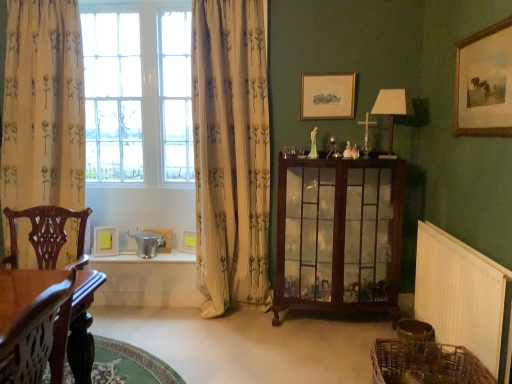
What is the approximate width of matte silver picture frame at upper center, marked as the 2th picture frame in a right-to-left arrangement?

matte silver picture frame at upper center, marked as the 2th picture frame in a right-to-left arrangement, is 1.71 inches in width.

What do you see at coordinates (188, 242) in the screenshot?
I see `matte white picture frame at lower center, which is the third picture frame from left to right` at bounding box center [188, 242].

Image resolution: width=512 pixels, height=384 pixels. What do you see at coordinates (148, 280) in the screenshot?
I see `metallic silver table at lower center` at bounding box center [148, 280].

Identify the location of metallic silver table at lower center. Image resolution: width=512 pixels, height=384 pixels. (148, 280).

Image resolution: width=512 pixels, height=384 pixels. Identify the location of mahogany glass cabinet at center. (339, 235).

What do you see at coordinates (484, 82) in the screenshot? I see `wooden framed painting at upper right, placed as the fifth picture frame when sorted from back to front` at bounding box center [484, 82].

The height and width of the screenshot is (384, 512). What do you see at coordinates (105, 241) in the screenshot? I see `yellow paper at window, the 3th picture frame from the front` at bounding box center [105, 241].

Locate an element on the screen. white glass window at upper left is located at coordinates (138, 93).

Where is `matte silver picture frame at upper center, which ranks as the fourth picture frame in left-to-right order`? The image size is (512, 384). matte silver picture frame at upper center, which ranks as the fourth picture frame in left-to-right order is located at coordinates (327, 96).

Can you confirm if white fabric lampshade at right is wider than white floral fabric curtain at left, positioned as the 2th curtain in left-to-right order?

In fact, white fabric lampshade at right might be narrower than white floral fabric curtain at left, positioned as the 2th curtain in left-to-right order.

Is point (409, 112) more distant than point (255, 101)?

No, it is in front of (255, 101).

From the image's perspective, would you say white fabric lampshade at right is positioned over white floral fabric curtain at left, acting as the 1th curtain starting from the right?

Yes, from the image's perspective, white fabric lampshade at right is over white floral fabric curtain at left, acting as the 1th curtain starting from the right.

Looking at this image, is white fabric lampshade at right taller than white floral fabric curtain at left, acting as the 1th curtain starting from the right?

Incorrect, the height of white fabric lampshade at right is not larger of that of white floral fabric curtain at left, acting as the 1th curtain starting from the right.

Are metallic silver table at lower center and wooden framed painting at upper right, the 5th picture frame in the left-to-right sequence, beside each other?

metallic silver table at lower center and wooden framed painting at upper right, the 5th picture frame in the left-to-right sequence, are not in contact.

Is metallic silver table at lower center inside or outside of wooden framed painting at upper right, which is the first picture frame in front-to-back order?

metallic silver table at lower center is not inside wooden framed painting at upper right, which is the first picture frame in front-to-back order, it's outside.

Looking at this image, is metallic silver table at lower center at the right side of wooden framed painting at upper right, the 5th picture frame in the left-to-right sequence?

No, metallic silver table at lower center is not to the right of wooden framed painting at upper right, the 5th picture frame in the left-to-right sequence.

Considering the sizes of objects metallic silver table at lower center and wooden framed painting at upper right, the 5th picture frame in the left-to-right sequence, in the image provided, who is wider, metallic silver table at lower center or wooden framed painting at upper right, the 5th picture frame in the left-to-right sequence,?

With larger width is metallic silver table at lower center.

Who is more distant, metallic silver table at lower center or white floral fabric curtain at left, arranged as the second curtain when viewed from the right?

metallic silver table at lower center is further away from the camera.

From the image's perspective, which is above, metallic silver table at lower center or white floral fabric curtain at left, arranged as the second curtain when viewed from the right?

white floral fabric curtain at left, arranged as the second curtain when viewed from the right.

Who is smaller, metallic silver table at lower center or white floral fabric curtain at left, arranged as the second curtain when viewed from the right?

Smaller between the two is metallic silver table at lower center.

Is white floral fabric curtain at left, arranged as the second curtain when viewed from the right, at the back of metallic silver table at lower center?

metallic silver table at lower center is not turned away from white floral fabric curtain at left, arranged as the second curtain when viewed from the right.

Is point (193, 247) positioned before point (237, 169)?

No.

Which object is positioned more to the left, matte white picture frame at lower center, the fourth picture frame from the front, or white floral fabric curtain at left, acting as the 1th curtain starting from the right?

matte white picture frame at lower center, the fourth picture frame from the front.

Considering the sizes of matte white picture frame at lower center, the second picture frame positioned from the bottom, and white floral fabric curtain at left, positioned as the 2th curtain in left-to-right order, in the image, is matte white picture frame at lower center, the second picture frame positioned from the bottom, wider or thinner than white floral fabric curtain at left, positioned as the 2th curtain in left-to-right order,?

Clearly, matte white picture frame at lower center, the second picture frame positioned from the bottom, has less width compared to white floral fabric curtain at left, positioned as the 2th curtain in left-to-right order.

From a real-world perspective, relative to white floral fabric curtain at left, positioned as the 2th curtain in left-to-right order, is matte white picture frame at lower center, which is the third picture frame from left to right, vertically above or below?

In terms of real-world spatial position, matte white picture frame at lower center, which is the third picture frame from left to right, is below white floral fabric curtain at left, positioned as the 2th curtain in left-to-right order.

Is woven brown basket at lower right placed right next to yellow paper at window, the 3th picture frame from the back?

No, woven brown basket at lower right is not in contact with yellow paper at window, the 3th picture frame from the back.

Is woven brown basket at lower right smaller than yellow paper at window, acting as the 3th picture frame starting from the bottom?

No.

Which object is thinner, woven brown basket at lower right or yellow paper at window, the first picture frame from the left?

With smaller width is yellow paper at window, the first picture frame from the left.

Could you measure the distance between woven brown basket at lower right and yellow paper at window, the 3th picture frame from the front?

2.41 meters.

Does white glass window at upper left have a greater height compared to metallic silver table at lower center?

Yes, white glass window at upper left is taller than metallic silver table at lower center.

Is white glass window at upper left facing away from metallic silver table at lower center?

That's not correct — white glass window at upper left is not looking away from metallic silver table at lower center.

Does point (164, 71) come closer to viewer compared to point (167, 274)?

No, (164, 71) is behind (167, 274).

From a real-world perspective, is white glass window at upper left on top of metallic silver table at lower center?

Yes, from a real-world perspective, white glass window at upper left is above metallic silver table at lower center.

From the image's perspective, who appears lower, yellow paper at window, acting as the 3th picture frame starting from the bottom, or white fabric lampshade at right?

yellow paper at window, acting as the 3th picture frame starting from the bottom, is shown below in the image.

Could you tell me if yellow paper at window, the first picture frame from the left, is turned towards white fabric lampshade at right?

No.

Does point (100, 243) lie in front of point (375, 106)?

No.

Identify the location of lamp above the yellow paper at window, the first picture frame from the left (from the image's perspective). (392, 108).

Where is `lamp on the right of white floral fabric curtain at left, acting as the 1th curtain starting from the right`? This screenshot has height=384, width=512. lamp on the right of white floral fabric curtain at left, acting as the 1th curtain starting from the right is located at coordinates (392, 108).

From a real-world perspective, which picture frame is the 4th one above the metallic silver table at lower center? Please provide its 2D coordinates.

[(484, 82)]

Which object lies further to the anchor point yellow paper at window, acting as the 3th picture frame starting from the bottom, white floral fabric curtain at left, arranged as the second curtain when viewed from the right, or metallic silver table at lower center?

white floral fabric curtain at left, arranged as the second curtain when viewed from the right.

Based on their spatial positions, is mahogany glass cabinet at center or woven brown basket at lower right further from yellow paper at window, the fifth picture frame when ordered from right to left?

The object further to yellow paper at window, the fifth picture frame when ordered from right to left, is woven brown basket at lower right.

Which object lies further to the anchor point matte silver picture frame at upper center, positioned as the fifth picture frame in bottom-to-top order, mahogany glass cabinet at center or white floral fabric curtain at left, arranged as the second curtain when viewed from the right?

white floral fabric curtain at left, arranged as the second curtain when viewed from the right, is further to matte silver picture frame at upper center, positioned as the fifth picture frame in bottom-to-top order.

When comparing their distances from mahogany glass cabinet at center, does matte white picture frame at lower center, arranged as the third picture frame when viewed from the right, or metallic silver table at lower center seem further?

Among the two, matte white picture frame at lower center, arranged as the third picture frame when viewed from the right, is located further to mahogany glass cabinet at center.

Estimate the real-world distances between objects in this image. Which object is further from yellow paper at window, acting as the 3th picture frame starting from the bottom, white glass window at upper left or wooden framed painting at upper right, the 2th picture frame from the top?

Based on the image, wooden framed painting at upper right, the 2th picture frame from the top, appears to be further to yellow paper at window, acting as the 3th picture frame starting from the bottom.

Considering their positions, is matte white picture frame at lower center, the fourth picture frame from the front, positioned closer to white floral fabric curtain at left, arranged as the second curtain when viewed from the right, than white plastic radiator at lower right?

matte white picture frame at lower center, the fourth picture frame from the front, lies closer to white floral fabric curtain at left, arranged as the second curtain when viewed from the right, than the other object.

Looking at the image, which one is located further to mahogany glass cabinet at center, white fabric lampshade at right or white floral fabric curtain at left, acting as the 1th curtain starting from the right?

white fabric lampshade at right is positioned further to the anchor mahogany glass cabinet at center.

Considering their positions, is white plastic radiator at lower right positioned further to wooden framed painting at upper right, the 5th picture frame in the left-to-right sequence, than metallic silver picture frame at lower center, which appears as the 4th picture frame when viewed from the right?

metallic silver picture frame at lower center, which appears as the 4th picture frame when viewed from the right.

This screenshot has width=512, height=384. Find the location of `lamp between wooden framed painting at upper right, the 2th picture frame from the top, and white plastic radiator at lower right in the up-down direction`. lamp between wooden framed painting at upper right, the 2th picture frame from the top, and white plastic radiator at lower right in the up-down direction is located at coordinates (392, 108).

The height and width of the screenshot is (384, 512). Identify the location of furniture located between white floral fabric curtain at left, the 1th curtain in the left-to-right sequence, and white fabric lampshade at right in the left-right direction. pos(339,235).

Where is `basket between white floral fabric curtain at left, the 1th curtain in the left-to-right sequence, and wooden framed painting at upper right, acting as the first picture frame starting from the right, in the horizontal direction`? basket between white floral fabric curtain at left, the 1th curtain in the left-to-right sequence, and wooden framed painting at upper right, acting as the first picture frame starting from the right, in the horizontal direction is located at coordinates (425, 363).

Find the location of a particular element. furniture between yellow paper at window, the 3th picture frame from the front, and white fabric lampshade at right, in the horizontal direction is located at coordinates (339, 235).